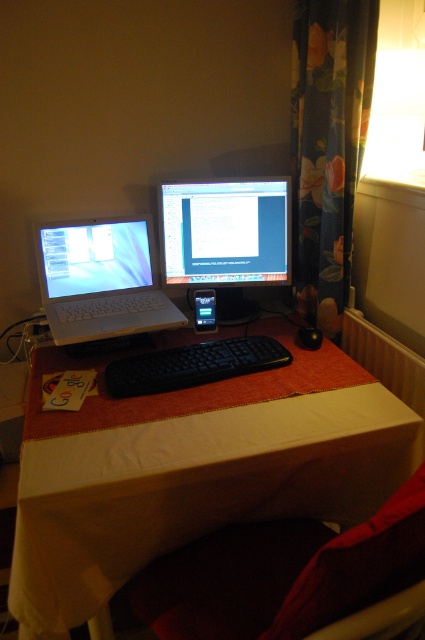
Is point (266, 227) closer to camera compared to point (119, 241)?

No, it is behind (119, 241).

Is matte black monitor at center taller than matte black laptop at left?

Yes.

Describe the element at coordinates (226, 237) in the screenshot. I see `matte black monitor at center` at that location.

Where is `matte black monitor at center`? The height and width of the screenshot is (640, 425). matte black monitor at center is located at coordinates (226, 237).

Between white cloth-covered table at center and matte black laptop at left, which one appears on the right side from the viewer's perspective?

white cloth-covered table at center is more to the right.

Is white cloth-covered table at center taller than matte black laptop at left?

Correct, white cloth-covered table at center is much taller as matte black laptop at left.

Is point (235, 470) farther from camera compared to point (96, 230)?

No, it is in front of (96, 230).

Image resolution: width=425 pixels, height=640 pixels. In order to click on white cloth-covered table at center in this screenshot , I will do `click(192, 483)`.

Who is shorter, dark fabric chair at lower center or white plastic laptop at left?

Standing shorter between the two is dark fabric chair at lower center.

Based on the photo, is dark fabric chair at lower center positioned behind white plastic laptop at left?

No, it is not.

Is point (214, 596) behind point (39, 253)?

No, it is in front of (39, 253).

The height and width of the screenshot is (640, 425). Identify the location of dark fabric chair at lower center. (283, 573).